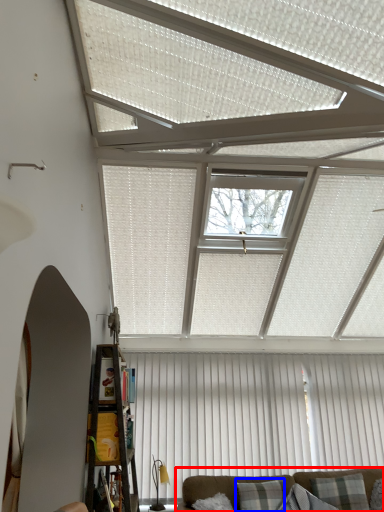
Question: Which object appears farthest to the camera in this image, studio couch (highlighted by a red box) or pillow (highlighted by a blue box)?

Choices:
 (A) studio couch
 (B) pillow

Answer: (B)